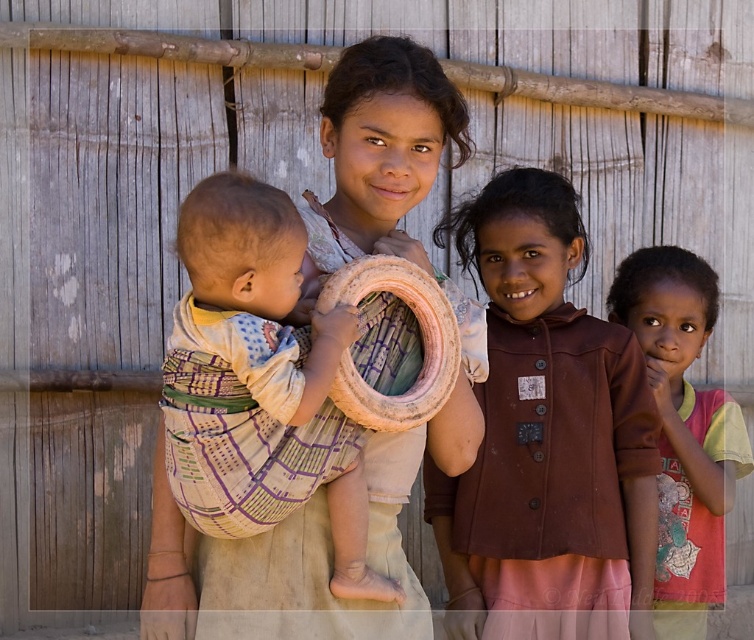
Question: Is soft beige fabric baby at center above pink fabric shirt at right?

Choices:
 (A) yes
 (B) no

Answer: (A)

Question: Is the position of brown matte jacket at center more distant than that of soft beige fabric baby at center?

Choices:
 (A) no
 (B) yes

Answer: (B)

Question: Among these points, which one is farthest from the camera?

Choices:
 (A) (667, 460)
 (B) (543, 378)
 (C) (198, 204)

Answer: (A)

Question: Estimate the real-world distances between objects in this image. Which object is closer to the pink fabric shirt at right?

Choices:
 (A) brown matte jacket at center
 (B) soft beige fabric baby at center

Answer: (A)

Question: Which of the following is the closest to the observer?

Choices:
 (A) (268, 509)
 (B) (569, 336)
 (C) (716, 410)

Answer: (A)

Question: Is soft beige fabric baby at center bigger than pink fabric shirt at right?

Choices:
 (A) yes
 (B) no

Answer: (B)